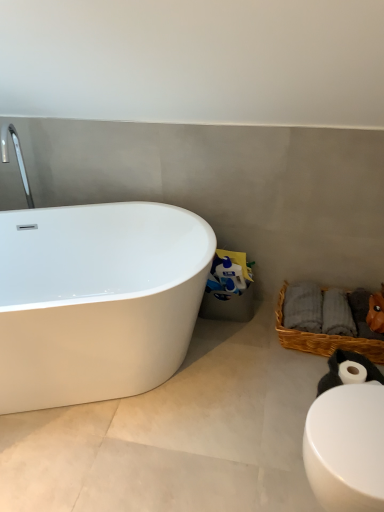
Question: From the image's perspective, is white matte toilet paper roll at lower right above or below white glossy bathtub at left?

Choices:
 (A) above
 (B) below

Answer: (A)

Question: From a real-world perspective, is white matte toilet paper roll at lower right positioned above or below white glossy bathtub at left?

Choices:
 (A) below
 (B) above

Answer: (B)

Question: Estimate the real-world distances between objects in this image. Which object is farther from the white glossy bathtub at left?

Choices:
 (A) woven brown basket at lower right
 (B) white glossy toilet at lower right
 (C) white glossy bathtub at left
 (D) white matte toilet paper roll at lower right

Answer: (D)

Question: Which object is positioned farthest from the white glossy bathtub at left?

Choices:
 (A) white glossy bathtub at left
 (B) white matte toilet paper roll at lower right
 (C) woven brown basket at lower right
 (D) white glossy toilet at lower right

Answer: (D)